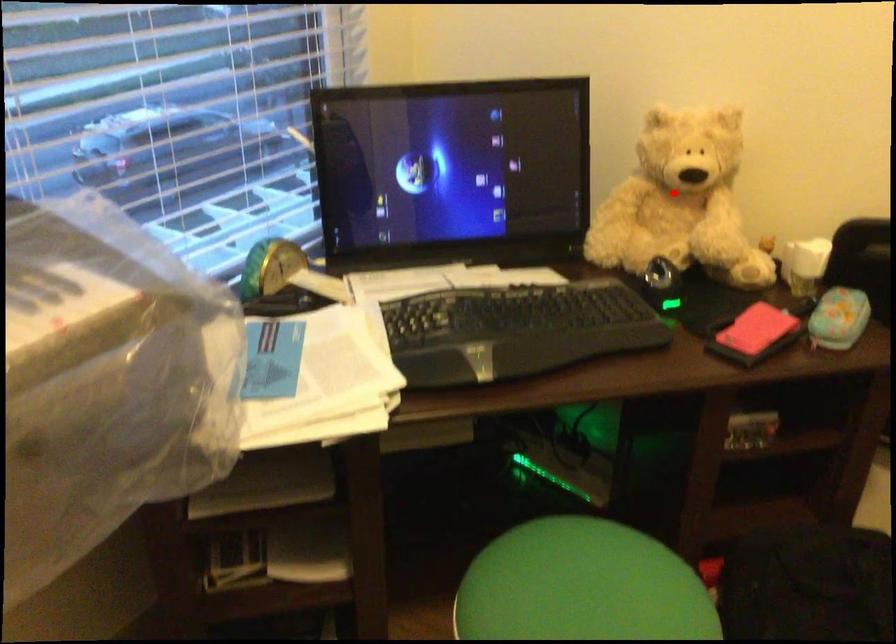
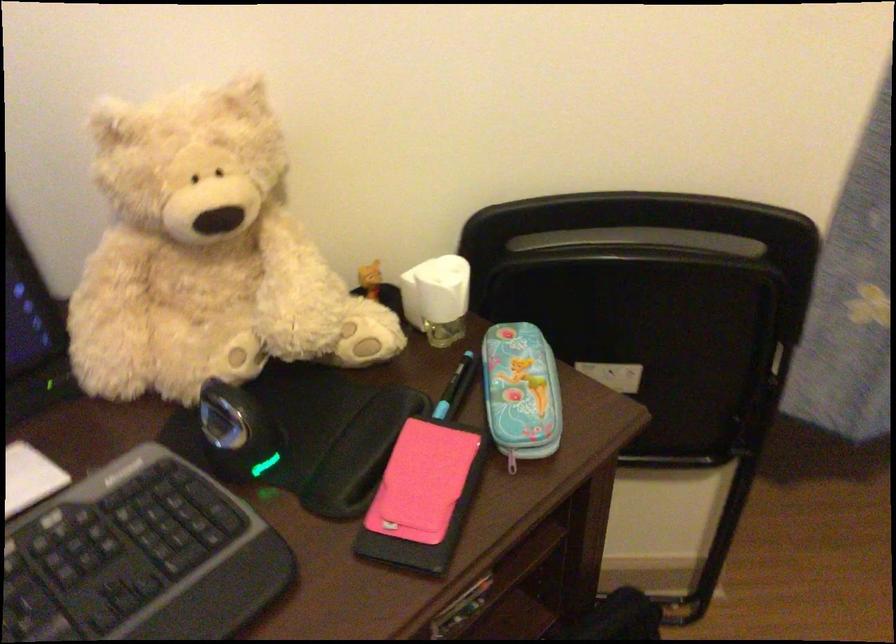
Locate, in the second image, the point that corresponds to the highlighted location in the first image.

(205, 254)